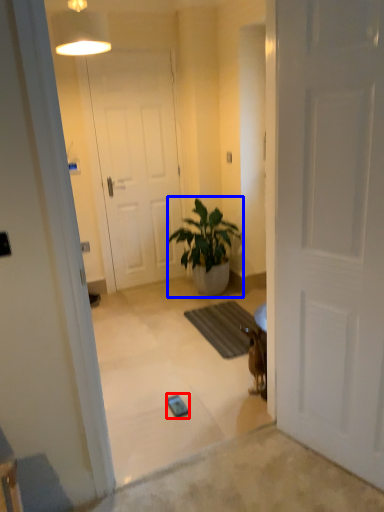
Question: Which object is further to the camera taking this photo, mobile phone (highlighted by a red box) or houseplant (highlighted by a blue box)?

Choices:
 (A) mobile phone
 (B) houseplant

Answer: (B)